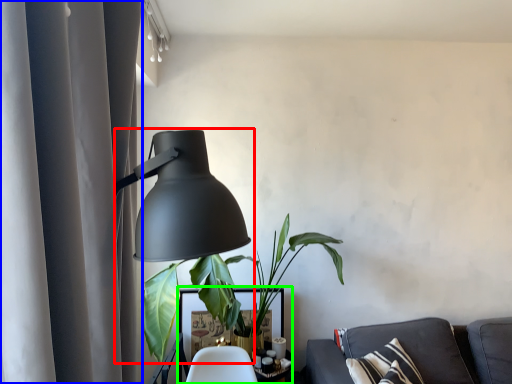
Question: Which object is positioned closest to lamp (highlighted by a red box)? Select from curtain (highlighted by a blue box) and table (highlighted by a green box).

Choices:
 (A) curtain
 (B) table

Answer: (B)